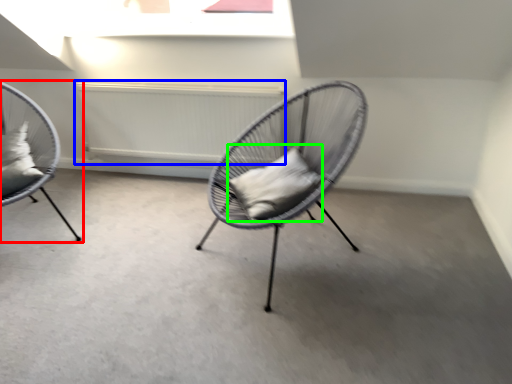
Question: Which object is the farthest from chair (highlighted by a red box)? Choose among these: radiator (highlighted by a blue box) or pillow (highlighted by a green box).

Choices:
 (A) radiator
 (B) pillow

Answer: (B)